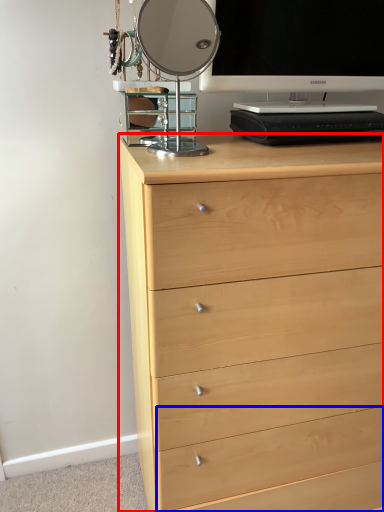
Question: Which object appears farthest to the camera in this image, chest of drawers (highlighted by a red box) or drawer (highlighted by a blue box)?

Choices:
 (A) chest of drawers
 (B) drawer

Answer: (B)